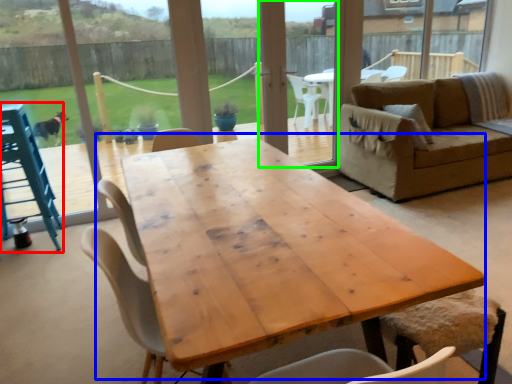
Question: Estimate the real-world distances between objects in this image. Which object is farther from feeding chair (highlighted by a red box), coffee table (highlighted by a blue box) or screen door (highlighted by a green box)?

Choices:
 (A) coffee table
 (B) screen door

Answer: (B)